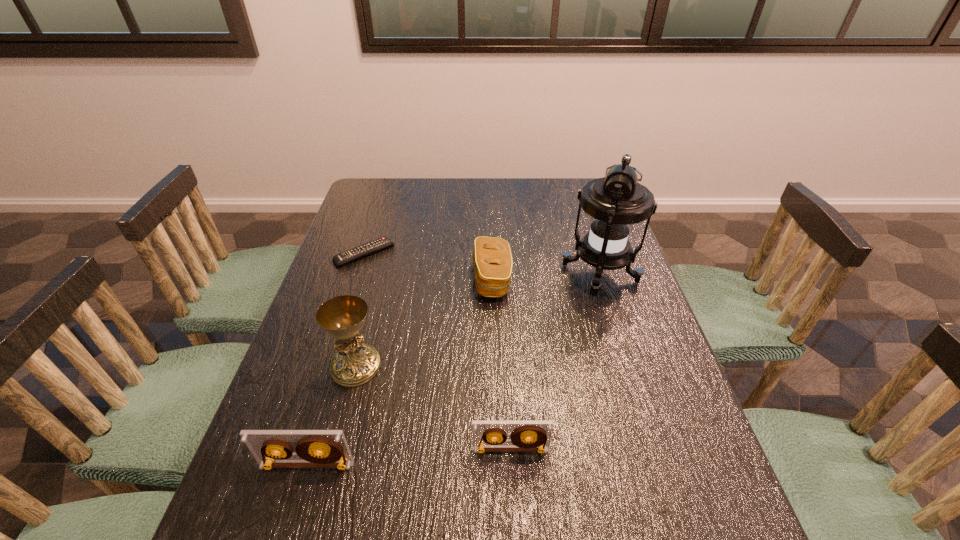
Identify the location of blank space located on the zipper side of the clutch bag. (378, 279).

Where is `vacant space located 0.350m on the zipper side of the clutch bag`? Image resolution: width=960 pixels, height=540 pixels. vacant space located 0.350m on the zipper side of the clutch bag is located at coordinates (350, 279).

Where is `vacant space located 0.150m on the zipper side of the clutch bag`? This screenshot has width=960, height=540. vacant space located 0.150m on the zipper side of the clutch bag is located at coordinates (420, 279).

Locate an element on the screen. This screenshot has height=540, width=960. free space located on the left of the tallest object is located at coordinates (x=511, y=273).

At what (x,y) coordinates should I click in order to perform the action: click on free spot located 0.380m on the front of the shortest object. Please return your answer as a coordinate pair (x, y). Looking at the image, I should click on (325, 375).

In order to click on vacant space situated on the back of the third nearest object in this screenshot , I will do `click(365, 332)`.

Where is `object present at the near edge`? The height and width of the screenshot is (540, 960). object present at the near edge is located at coordinates (316, 448).

Image resolution: width=960 pixels, height=540 pixels. Find the location of `videotape that is at the left edge`. videotape that is at the left edge is located at coordinates (316, 448).

You are a GUI agent. You are given a task and a screenshot of the screen. Output one action in this format:
    pyautogui.click(x=<x>, y=<y>)
    Task: Click on the remote control present at the left edge
    This screenshot has height=540, width=960.
    Given the screenshot: What is the action you would take?
    pyautogui.click(x=373, y=246)

Locate an element on the screen. The height and width of the screenshot is (540, 960). chalice located at the left edge is located at coordinates (355, 363).